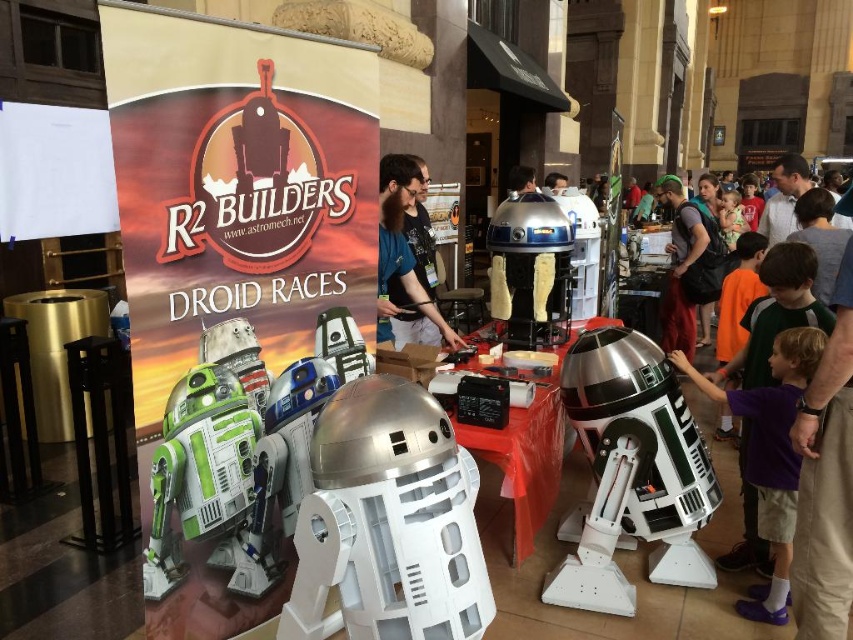
Question: Which is farther from the white plastic r2-d2 at center?

Choices:
 (A) metallic silver robot at center
 (B) satin silver robot at center
 (C) purple cotton shirt at center

Answer: (C)

Question: Which point is closer to the camera?

Choices:
 (A) (810, 380)
 (B) (614, 330)
 (C) (254, 396)

Answer: (C)

Question: Is white plastic r2-d2 at center thinner than green plastic toy at center?

Choices:
 (A) yes
 (B) no

Answer: (B)

Question: Is metallic blue droid at center to the left of blue fabric shirt at center from the viewer's perspective?

Choices:
 (A) yes
 (B) no

Answer: (B)

Question: Is green plastic toy at center in front of metallic silver robot at center?

Choices:
 (A) yes
 (B) no

Answer: (A)

Question: Estimate the real-world distances between objects in this image. Which object is farther from the shiny silver droid at center?

Choices:
 (A) satin silver robot at center
 (B) green matte r2-d2 at center
 (C) green plastic toy at center

Answer: (A)